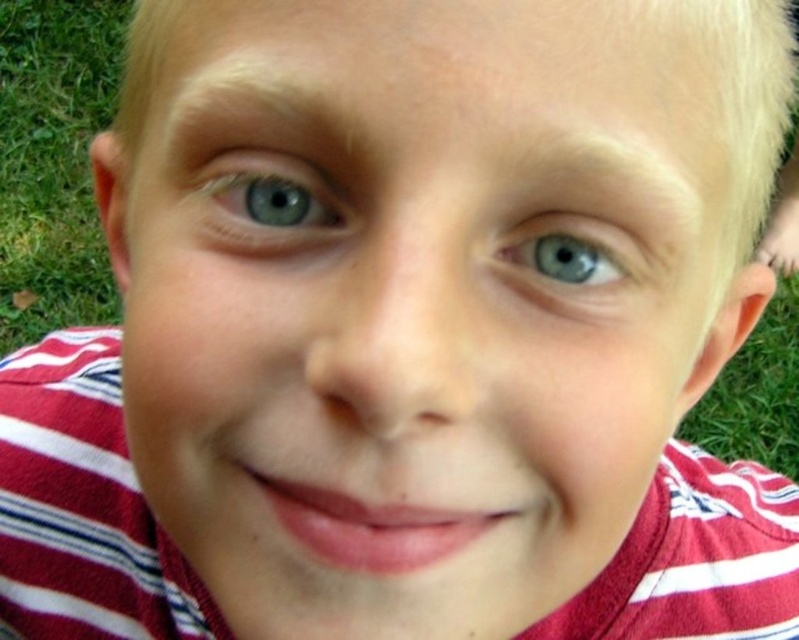
You are an artist trying to paint a portrait of the person in the image. You want to place the blue glossy eye at upper left precisely on the canvas. What are the coordinates where you should position it?

The blue glossy eye at upper left should be positioned at coordinates 0.316 on the x axis and 0.339 on the y axis.

You are standing in a park and see the green grass at lower left. If you want to reach it without moving your feet, can you stretch your hand to touch it?

The green grass at lower left is 1.88 meters away from the viewer, so you cannot stretch your hand to touch it without moving your feet.

You are a photographer trying to capture the blue glossy eye at upper left and the green grass at lower left in a single shot. Given that your camera can only focus on one object at a time, which object should you focus on to ensure it appears clearer in the photo?

The green grass at lower left has a larger size compared to the blue glossy eye at upper left, so focusing on the green grass at lower left would ensure it appears clearer in the photo.